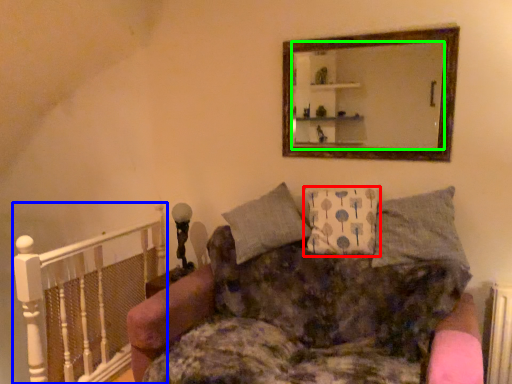
Question: Estimate the real-world distances between objects in this image. Which object is farther from pillow (highlighted by a red box), balustrade (highlighted by a blue box) or mirror (highlighted by a green box)?

Choices:
 (A) balustrade
 (B) mirror

Answer: (A)